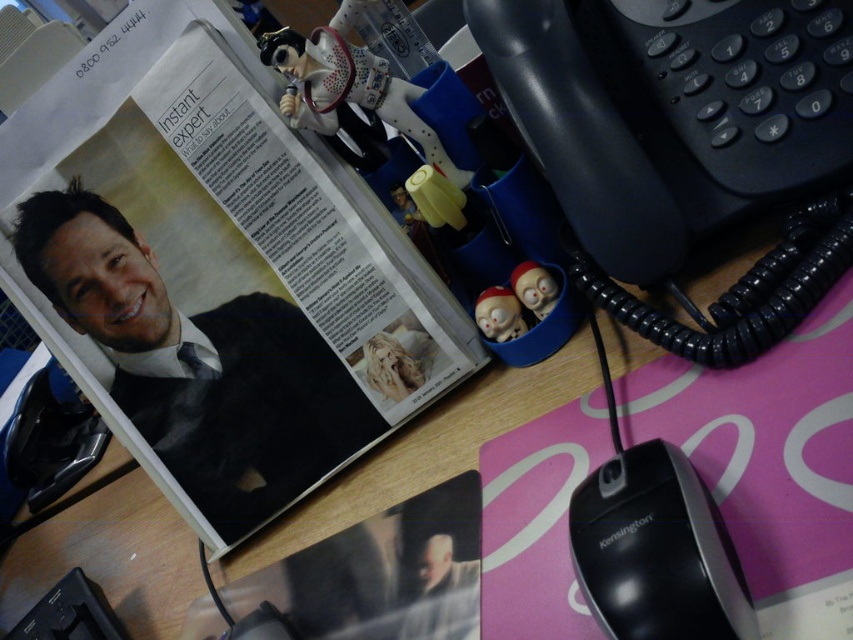
Question: Can you confirm if matte black suit at upper left is positioned to the left of black plastic mouse at lower right?

Choices:
 (A) no
 (B) yes

Answer: (B)

Question: Which point is closer to the camera?

Choices:
 (A) matte black suit at upper left
 (B) black plastic mouse at lower right

Answer: (B)

Question: Does matte black suit at upper left lie behind black plastic mouse at lower right?

Choices:
 (A) yes
 (B) no

Answer: (A)

Question: Which point is closer to the camera?

Choices:
 (A) black plastic mouse at lower right
 (B) matte black suit at upper left

Answer: (A)

Question: Does matte black suit at upper left have a smaller size compared to black plastic mouse at lower right?

Choices:
 (A) no
 (B) yes

Answer: (A)